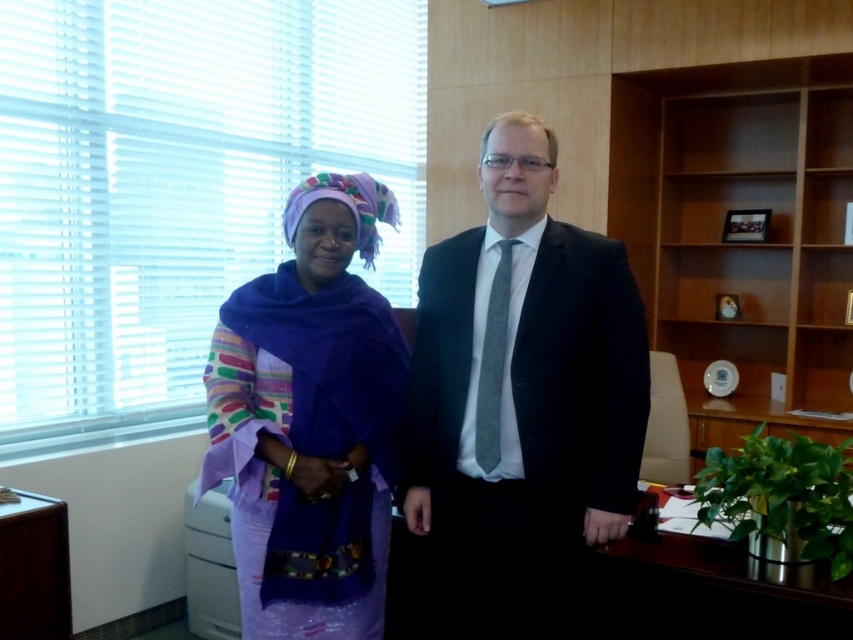
Is light brown wood bookshelf at right smaller than purple fabric at left?

Incorrect, light brown wood bookshelf at right is not smaller in size than purple fabric at left.

Which is behind, point (744, 416) or point (372, 352)?

The point (744, 416) is behind.

This screenshot has width=853, height=640. In order to click on light brown wood bookshelf at right in this screenshot , I will do pyautogui.click(x=740, y=243).

Which is above, matte black suit at center or light brown wood bookshelf at right?

light brown wood bookshelf at right

Does matte black suit at center appear over light brown wood bookshelf at right?

Actually, matte black suit at center is below light brown wood bookshelf at right.

Who is more distant from viewer, (444, 268) or (772, 259)?

Positioned behind is point (772, 259).

Where is `matte black suit at center`? This screenshot has width=853, height=640. matte black suit at center is located at coordinates (521, 397).

Can you confirm if matte black suit at center is taller than purple fabric at left?

Indeed, matte black suit at center has a greater height compared to purple fabric at left.

Is point (445, 259) farther from viewer compared to point (372, 356)?

Yes, point (445, 259) is behind point (372, 356).

Identify the location of matte black suit at center. (521, 397).

Where is `matte black suit at center`? This screenshot has height=640, width=853. matte black suit at center is located at coordinates (521, 397).